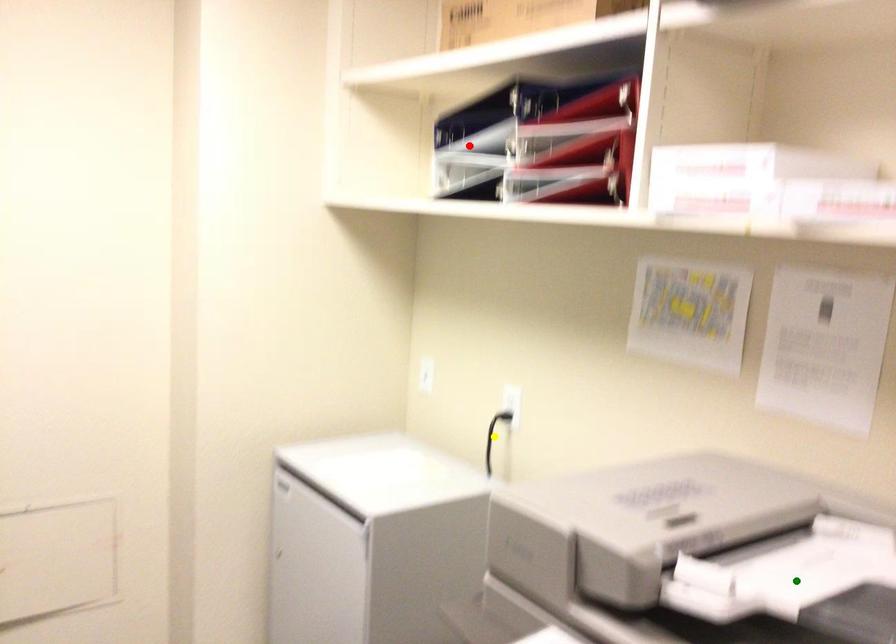
Order these from nearest to farthest:
yellow point
red point
green point

1. yellow point
2. red point
3. green point